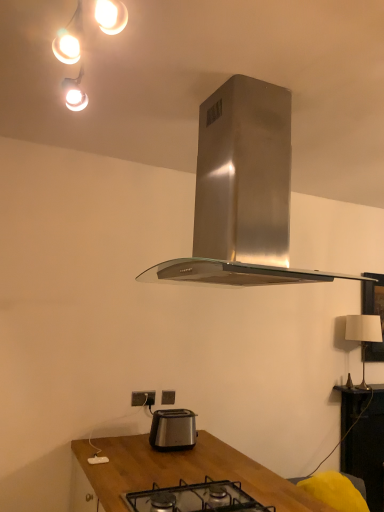
This screenshot has width=384, height=512. What are the coordinates of `free space above stainless steel range hood at center (from a real-world perspective)` in the screenshot? It's located at (244, 84).